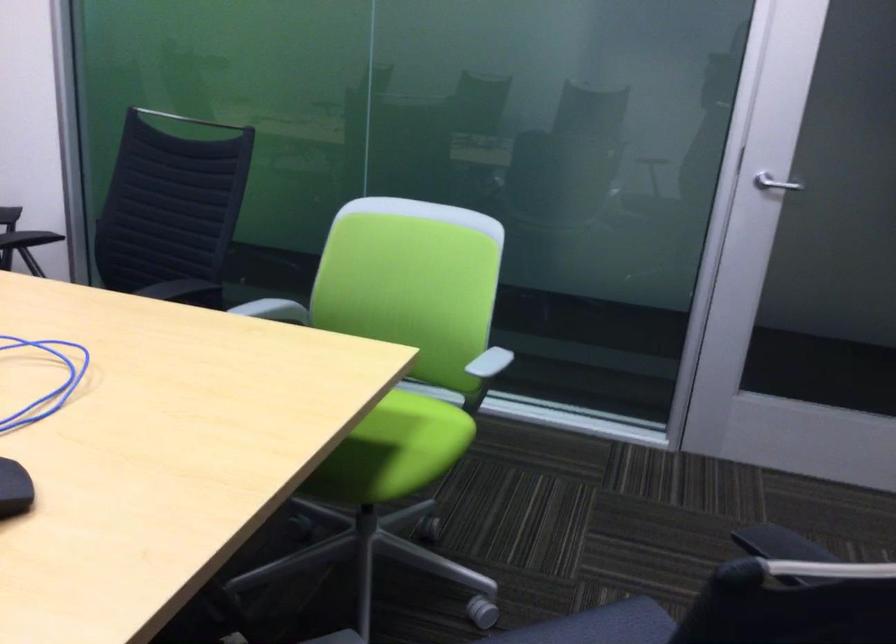
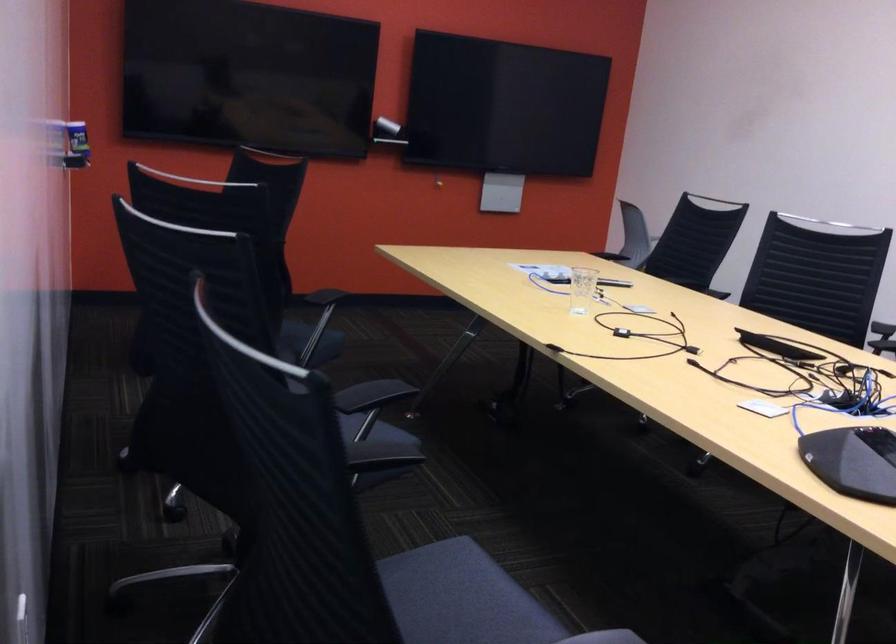
Question: How did the camera likely rotate?

Choices:
 (A) Left
 (B) Right
 (C) Up
 (D) Down

Answer: (A)